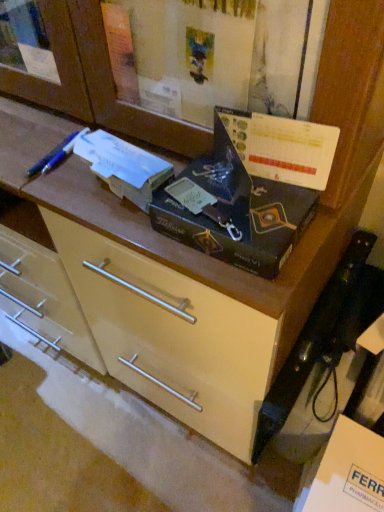
The height and width of the screenshot is (512, 384). Identify the location of free space above white cardboard box at lower right (from a real-world perspective). (347, 470).